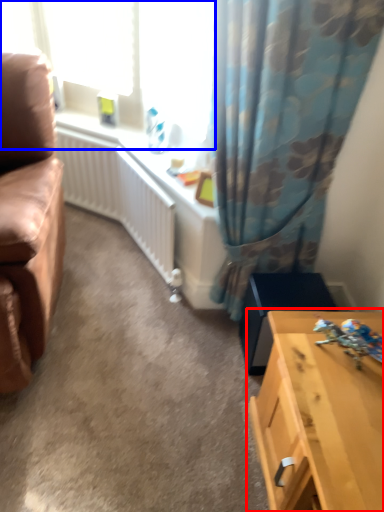
Question: Which object appears closest to the camera in this image, table (highlighted by a red box) or window screen (highlighted by a blue box)?

Choices:
 (A) table
 (B) window screen

Answer: (A)